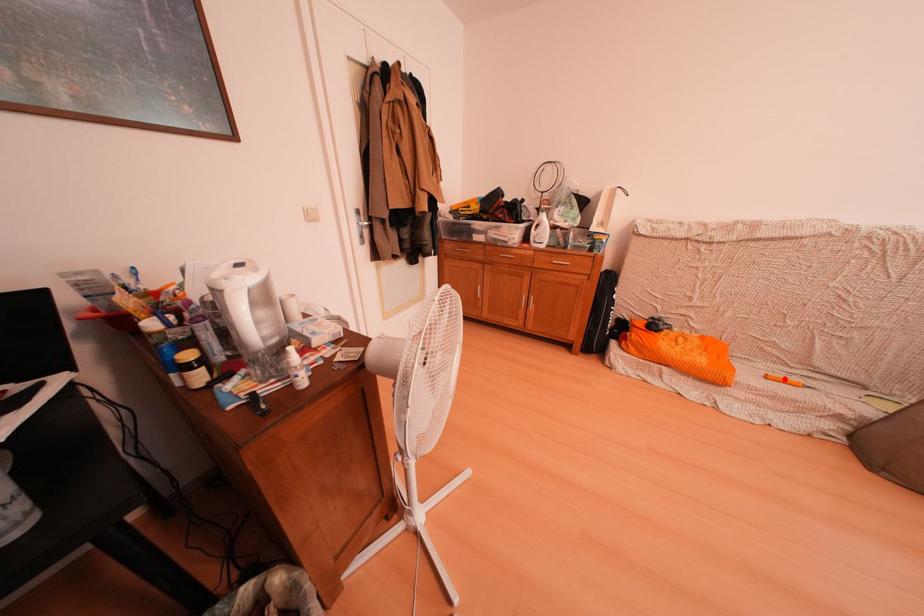
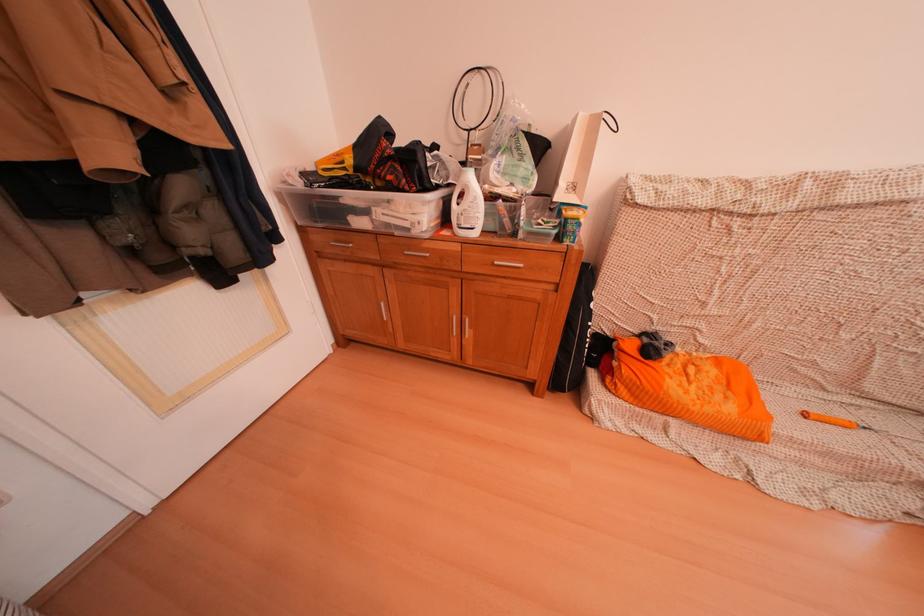
Locate, in the second image, the point that corresponds to the highlighted location in the first image.

(824, 415)